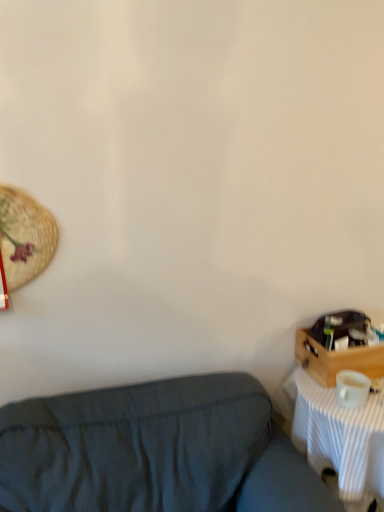
Identify the location of vacant space situated above wooden crate at right (from a real-world perspective). (349, 331).